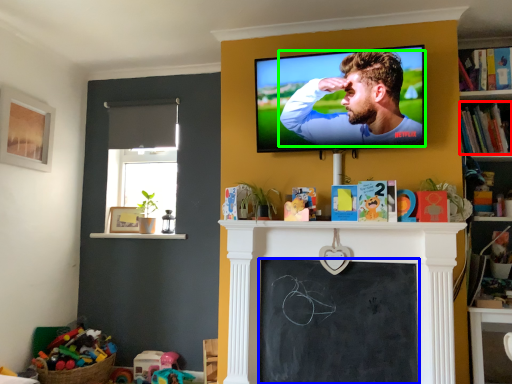
Question: Estimate the real-world distances between objects in this image. Which object is closer to book (highlighted by a red box), bulletin board (highlighted by a blue box) or man (highlighted by a green box)?

Choices:
 (A) bulletin board
 (B) man

Answer: (B)